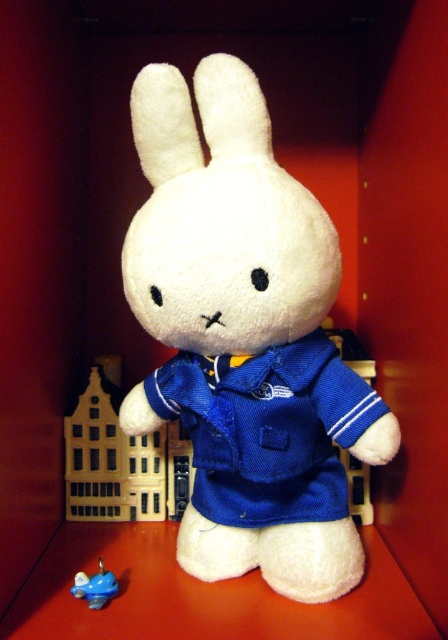
Based on the photo, you are organizing a toy store shelf and need to place the white plush rabbit at center and the blue rubber duck at lower left. If the shelf has a width of 1 meter, can both toys fit side by side without overlapping?

The white plush rabbit at center might be wider than blue rubber duck at lower left. Since the exact widths are not provided, it is uncertain if both can fit within 1 meter. Measure both toys to confirm.

You are organizing a toy store shelf and need to place the white plush rabbit at center and the blue rubber duck at lower left. Since the rabbit is larger, where should you position them to ensure both are visible?

The white plush rabbit at center should be placed at a higher position and the blue rubber duck at lower left at a lower position to ensure both are visible, as the white plush rabbit at center is larger than the blue rubber duck at lower left.